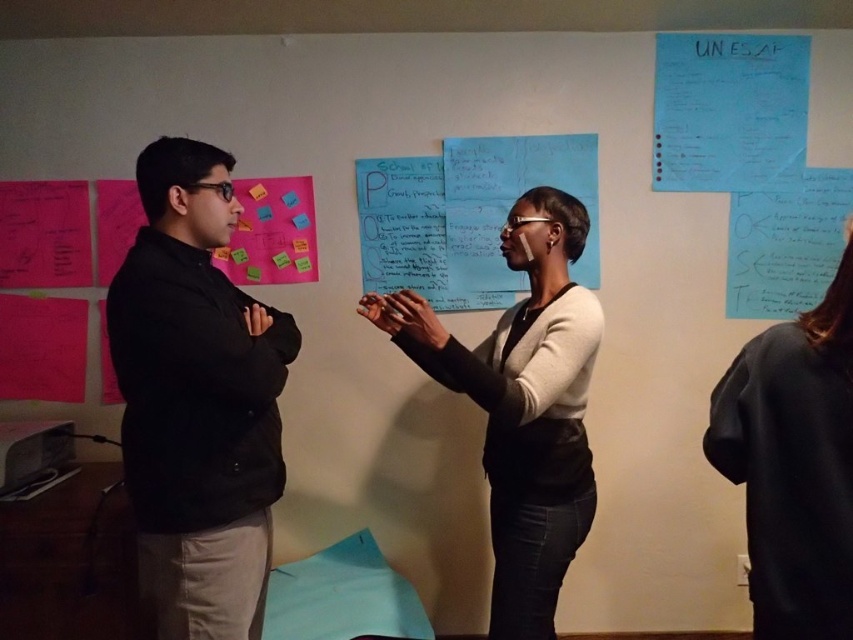
You are an observer in the room. You notice the black matte shirt at right and the bright pink paper at upper left. Which object is closer to you?

The black matte shirt at right is closer to you because it is in front of the bright pink paper at upper left.

You are standing in the room where the image is taken. If you face the two people, which direction should you turn to locate the black matte jacket at left?

Since the black matte jacket at left is positioned at the left side of the scene, you should turn to your left to locate it.